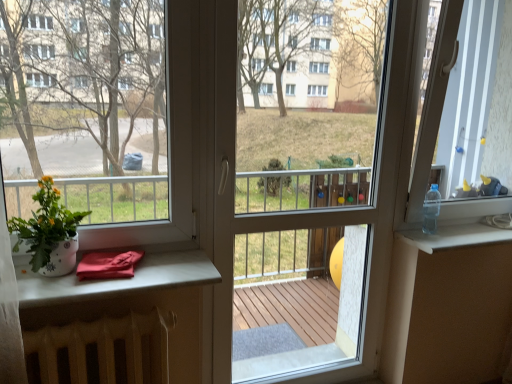
Question: Is the depth of white radiator at lower left, marked as the 2th table in a top-to-bottom arrangement, greater than that of transparent plastic bottle at upper right?

Choices:
 (A) yes
 (B) no

Answer: (B)

Question: Does white radiator at lower left, the 1th table positioned from the bottom, have a larger size compared to transparent plastic bottle at upper right?

Choices:
 (A) yes
 (B) no

Answer: (A)

Question: Is white radiator at lower left, the 1th table positioned from the bottom, not close to transparent plastic bottle at upper right?

Choices:
 (A) no
 (B) yes

Answer: (B)

Question: Does white radiator at lower left, the 1th table positioned from the bottom, have a lesser height compared to transparent plastic bottle at upper right?

Choices:
 (A) no
 (B) yes

Answer: (A)

Question: Does white radiator at lower left, marked as the 2th table in a top-to-bottom arrangement, appear on the left side of transparent plastic bottle at upper right?

Choices:
 (A) yes
 (B) no

Answer: (A)

Question: Is white radiator at lower left, the 1th table positioned from the bottom, wider than transparent plastic bottle at upper right?

Choices:
 (A) no
 (B) yes

Answer: (A)

Question: Could you tell me if transparent plastic bottle at right is facing white glossy flower pot at left?

Choices:
 (A) yes
 (B) no

Answer: (B)

Question: From a real-world perspective, is transparent plastic bottle at right under white glossy flower pot at left?

Choices:
 (A) no
 (B) yes

Answer: (A)

Question: From a real-world perspective, is transparent plastic bottle at right on white glossy flower pot at left?

Choices:
 (A) yes
 (B) no

Answer: (A)

Question: Does transparent plastic bottle at right have a larger size compared to white glossy flower pot at left?

Choices:
 (A) yes
 (B) no

Answer: (A)

Question: From the image's perspective, is transparent plastic bottle at right located above white glossy flower pot at left?

Choices:
 (A) no
 (B) yes

Answer: (B)

Question: Is transparent plastic bottle at right further to the viewer compared to white glossy flower pot at left?

Choices:
 (A) no
 (B) yes

Answer: (B)

Question: Is white glossy pot at left at the back of white radiator at lower left, the 1th table positioned from the bottom?

Choices:
 (A) no
 (B) yes

Answer: (A)